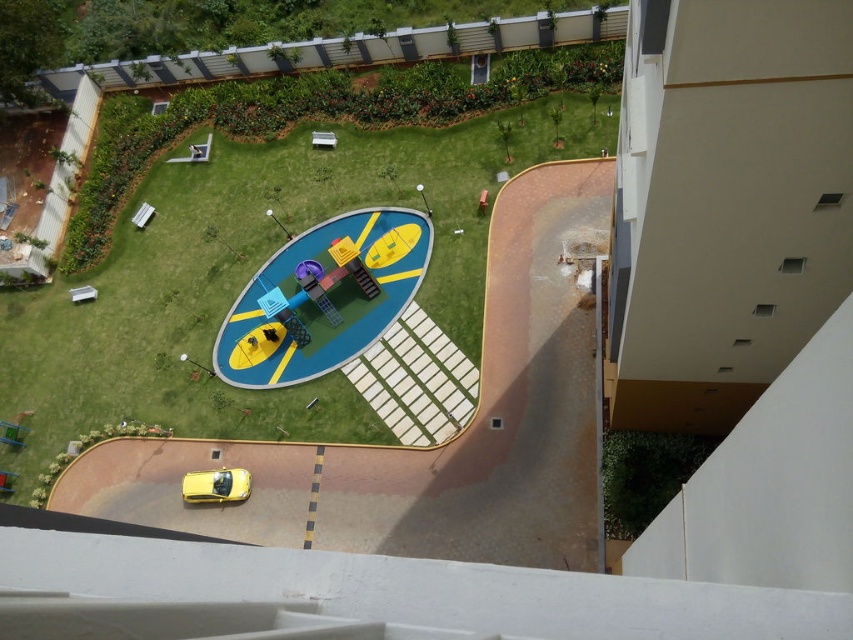
Which is above, green grass at center or yellow matte car at lower left?

green grass at center is higher up.

Is green grass at center above yellow matte car at lower left?

Correct, green grass at center is located above yellow matte car at lower left.

The width and height of the screenshot is (853, 640). What do you see at coordinates (248, 276) in the screenshot?
I see `green grass at center` at bounding box center [248, 276].

Identify the location of green grass at center. (248, 276).